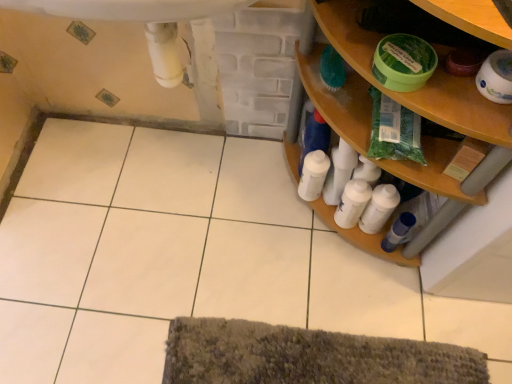
Where is `vacant region in front of wooden shelf at right`? vacant region in front of wooden shelf at right is located at coordinates (351, 316).